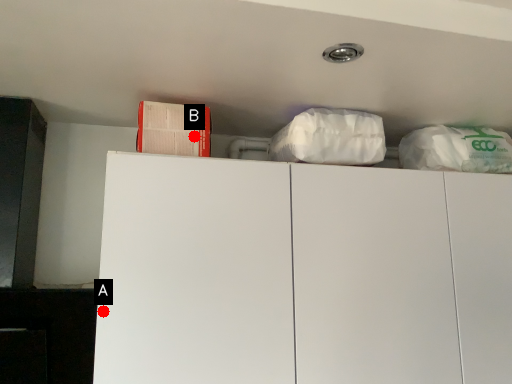
Question: Two points are circled on the image, labeled by A and B beside each circle. Among these points, which one is nearest to the camera?

Choices:
 (A) A is closer
 (B) B is closer

Answer: (A)